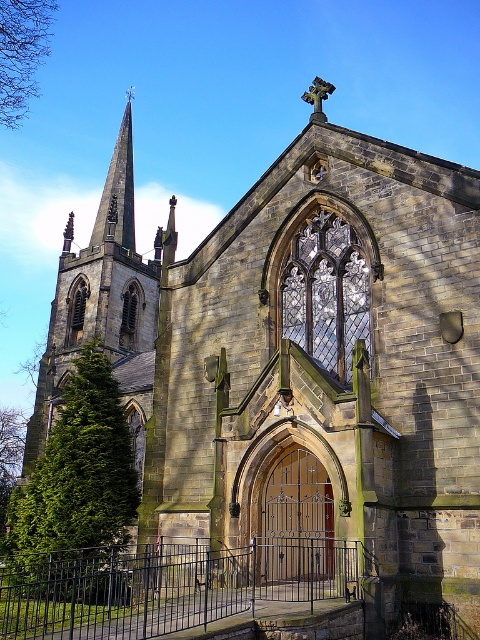
Is black metal fence at center to the right of smooth stone spire at upper left from the viewer's perspective?

Indeed, black metal fence at center is positioned on the right side of smooth stone spire at upper left.

Between black metal fence at center and smooth stone spire at upper left, which one appears on the left side from the viewer's perspective?

smooth stone spire at upper left

Between point (225, 552) and point (98, 225), which one is positioned in front?

Point (225, 552)

Locate an element on the screen. This screenshot has height=640, width=480. black metal fence at center is located at coordinates (164, 586).